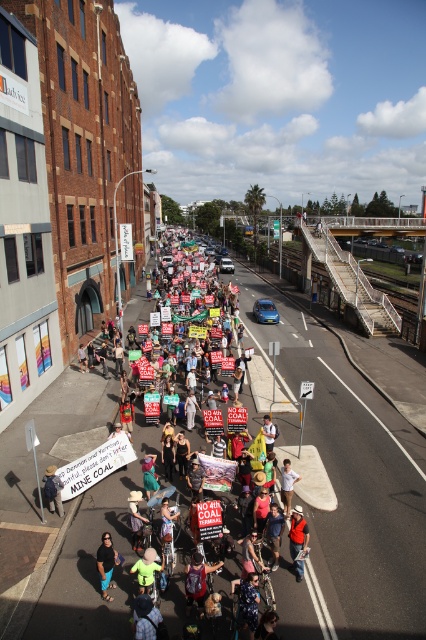
Is green fabric shirt at lower center thinner than yellow straw hat at center?

No, green fabric shirt at lower center is not thinner than yellow straw hat at center.

Is point (109, 544) positioned after point (54, 496)?

That is False.

Does point (104, 572) come in front of point (51, 467)?

Yes, point (104, 572) is closer to viewer.

Where is `green fabric shirt at lower center`? Image resolution: width=426 pixels, height=640 pixels. green fabric shirt at lower center is located at coordinates (106, 563).

Consider the image. Which is more to the right, red shirt at center or green fabric shirt at lower center?

red shirt at center

Can you confirm if red shirt at center is shorter than green fabric shirt at lower center?

Incorrect, red shirt at center's height does not fall short of green fabric shirt at lower center's.

Is point (301, 577) positioned behind point (109, 544)?

That is True.

This screenshot has height=640, width=426. I want to click on red shirt at center, so (x=298, y=540).

Is red shirt at center above white cotton shirt at center?

Incorrect, red shirt at center is not positioned above white cotton shirt at center.

Can you confirm if red shirt at center is shorter than white cotton shirt at center?

Incorrect, red shirt at center's height does not fall short of white cotton shirt at center's.

Based on the photo, who is more forward, (291, 513) or (288, 465)?

Point (291, 513) is in front.

This screenshot has height=640, width=426. I want to click on red shirt at center, so click(x=298, y=540).